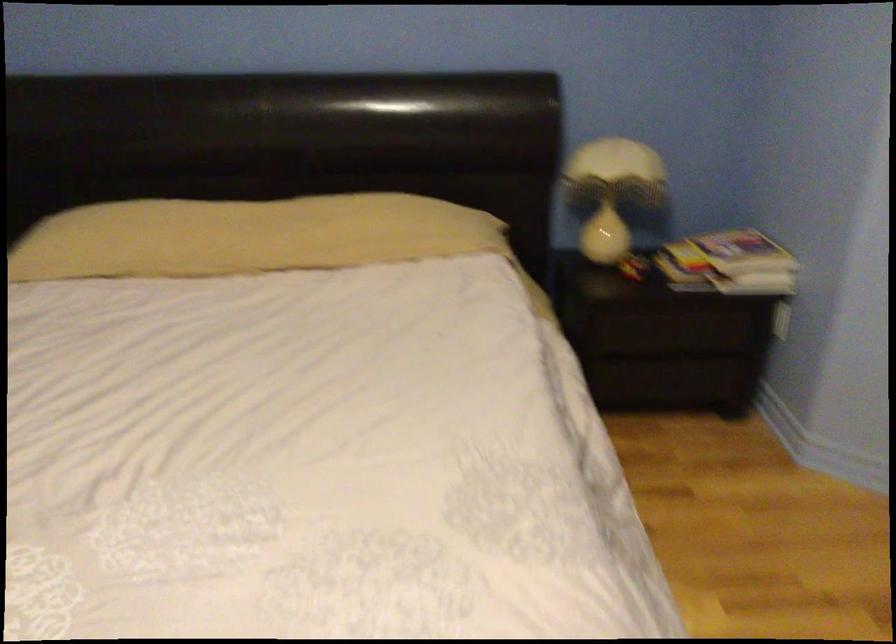
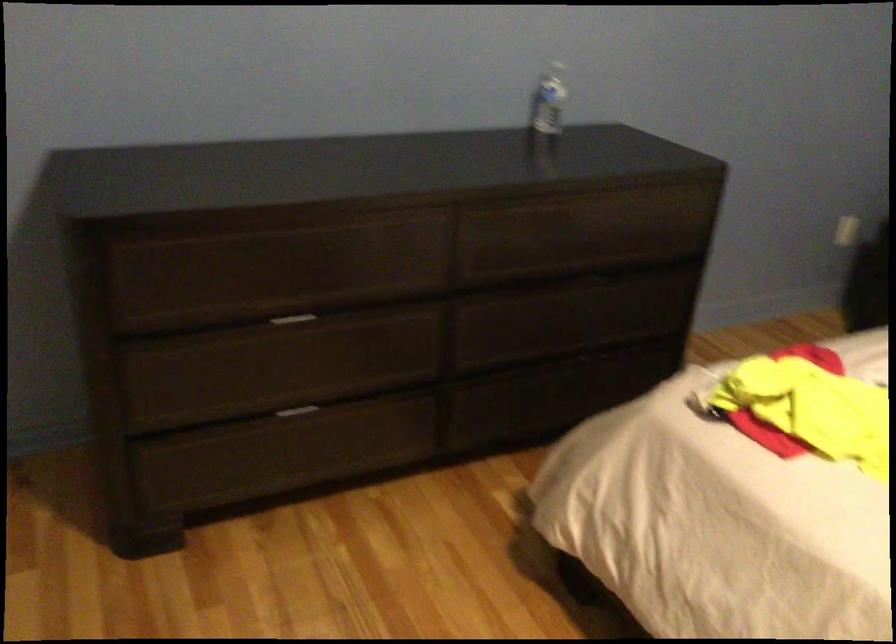
First-person continuous shooting, in which direction is the camera rotating?

The rotation direction of the camera is left-down.